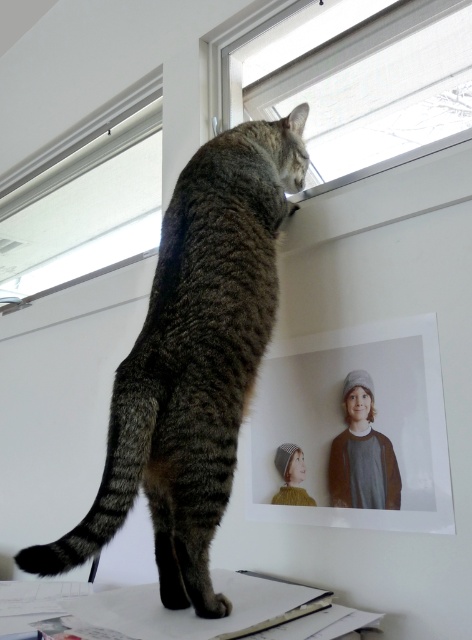
You are a cat owner who wants to hang a new photo on the wall where the matte paper photo at upper center is currently located. The tabby fur cat at upper center is known to be curious and might try to reach it. Given that the cat can jump up to 10 inches high, will the photo be within the cat s reach?

The distance between the tabby fur cat at upper center and the matte paper photo at upper center is 9.89 inches. Since the cat can jump up to 10 inches, the photo is within the cat s reach.

You are a photographer setting up a shot of the tabby cat and the window. You need to place two markers at the coordinates point (201, 570) and point (99, 195). Which marker should you place first if you want to start with the one closer to the cat?

You should place the marker at point (201, 570) first because it is closer to the viewer than point (99, 195), meaning it is nearer to the cat.

You are a delivery person who needs to place a small package on the floor between the matte paper photo at upper center and the white matte window at upper center. The package is 12 inches long. Is there enough space between them to place the package horizontally?

The distance between the matte paper photo at upper center and the white matte window at upper center is 37.30 inches. Since the package is only 12 inches long, there is sufficient space to place it horizontally between them.